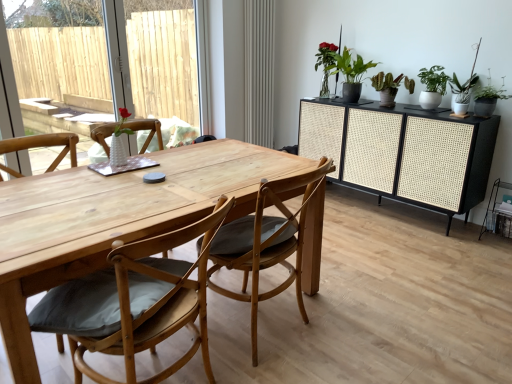
Measure the distance between point (103, 223) and camera.

Point (103, 223) and camera are 4.85 feet apart.

What do you see at coordinates (432, 86) in the screenshot? I see `green matte plant at upper right, the first houseplant viewed from the right` at bounding box center [432, 86].

Find the location of a particular element. green matte plant at upper right, which is the third houseplant from left to right is located at coordinates (432, 86).

This screenshot has height=384, width=512. What do you see at coordinates (390, 87) in the screenshot?
I see `green matte cactus at upper right, which is the 2th houseplant from left to right` at bounding box center [390, 87].

I want to click on green matte plant at upper right, the third houseplant from the right, so click(x=350, y=73).

Locate an element on the screen. This screenshot has width=512, height=384. white textured vase at left is located at coordinates (164, 67).

What do you see at coordinates (325, 64) in the screenshot? The image size is (512, 384). I see `green glossy vase at upper center` at bounding box center [325, 64].

Locate an element on the screen. The image size is (512, 384). matte gray radiator at center is located at coordinates (259, 71).

Which is more to the left, green matte plant at upper right, the third houseplant from the right, or green matte cactus at upper right, which is the 2th houseplant from left to right?

green matte plant at upper right, the third houseplant from the right.

In order to click on the 1st houseplant counting from the right of the green matte plant at upper right, the first houseplant from the left in this screenshot , I will do `click(390, 87)`.

Based on the photo, how distant is green matte plant at upper right, the third houseplant from the right, from green matte cactus at upper right, which is the 2th houseplant from left to right?

green matte plant at upper right, the third houseplant from the right, and green matte cactus at upper right, which is the 2th houseplant from left to right, are 24.72 centimeters apart.

Between green matte plant at upper right, the first houseplant from the left, and green matte cactus at upper right, the second houseplant in the right-to-left sequence, which one has larger width?

green matte cactus at upper right, the second houseplant in the right-to-left sequence, is wider.

Is white textured vase at left positioned far away from green matte cactus at upper right, the second houseplant in the right-to-left sequence?

Indeed, white textured vase at left is not near green matte cactus at upper right, the second houseplant in the right-to-left sequence.

In the image, is white textured vase at left positioned in front of or behind green matte cactus at upper right, the second houseplant in the right-to-left sequence?

In the image, white textured vase at left appears in front of green matte cactus at upper right, the second houseplant in the right-to-left sequence.

Can you confirm if white textured vase at left is smaller than green matte cactus at upper right, the second houseplant in the right-to-left sequence?

Actually, white textured vase at left might be larger than green matte cactus at upper right, the second houseplant in the right-to-left sequence.

Is the depth of green matte cactus at upper right, which is the 2th houseplant from left to right, greater than that of white textured vase at left?

Yes, green matte cactus at upper right, which is the 2th houseplant from left to right, is further from the camera.

Is there a large distance between green matte cactus at upper right, which is the 2th houseplant from left to right, and white textured vase at left?

That's right, there is a large distance between green matte cactus at upper right, which is the 2th houseplant from left to right, and white textured vase at left.

From a real-world perspective, between green matte cactus at upper right, which is the 2th houseplant from left to right, and white textured vase at left, who is vertically lower?

green matte cactus at upper right, which is the 2th houseplant from left to right.

Who is smaller, green matte cactus at upper right, the second houseplant in the right-to-left sequence, or white textured vase at left?

green matte cactus at upper right, the second houseplant in the right-to-left sequence, is smaller.

Identify the location of table on the left of green glossy vase at upper center. The image size is (512, 384). (112, 220).

Is green glossy vase at upper center looking in the opposite direction of natural wood table at center?

No, green glossy vase at upper center is not facing away from natural wood table at center.

Is green glossy vase at upper center positioned in front of natural wood table at center?

No, it is not.

Can you confirm if wooden chair with cushion at center, which is counted as the 2th chair, starting from the right, is wider than natural wood chair at center, arranged as the second chair when viewed from the left?

Indeed, wooden chair with cushion at center, which is counted as the 2th chair, starting from the right, has a greater width compared to natural wood chair at center, arranged as the second chair when viewed from the left.

Is wooden chair with cushion at center, which is counted as the 2th chair, starting from the right, positioned with its back to natural wood chair at center, which is counted as the 1th chair, starting from the right?

No, wooden chair with cushion at center, which is counted as the 2th chair, starting from the right,'s orientation is not away from natural wood chair at center, which is counted as the 1th chair, starting from the right.

From a real-world perspective, is wooden chair with cushion at center, which is counted as the 2th chair, starting from the right, over natural wood chair at center, which is counted as the 1th chair, starting from the right?

No.

Is wooden chair with cushion at center, which is counted as the 2th chair, starting from the right, shorter than natural wood chair at center, arranged as the second chair when viewed from the left?

Indeed, wooden chair with cushion at center, which is counted as the 2th chair, starting from the right, has a lesser height compared to natural wood chair at center, arranged as the second chair when viewed from the left.

Is matte gray radiator at center to the right of green glossy vase at upper center from the viewer's perspective?

No, matte gray radiator at center is not to the right of green glossy vase at upper center.

From the image's perspective, which is above, matte gray radiator at center or green glossy vase at upper center?

matte gray radiator at center.

In the scene shown: From a real-world perspective, who is located lower, matte gray radiator at center or green glossy vase at upper center?

From a 3D spatial view, matte gray radiator at center is below.

Does matte gray radiator at center have a greater width compared to green glossy vase at upper center?

No, matte gray radiator at center is not wider than green glossy vase at upper center.

Could you tell me if green matte plant at upper right, the first houseplant from the left, is turned towards black woven cabinet at right?

No, green matte plant at upper right, the first houseplant from the left, is not turned towards black woven cabinet at right.

How far apart are green matte plant at upper right, the third houseplant from the right, and black woven cabinet at right?

green matte plant at upper right, the third houseplant from the right, and black woven cabinet at right are 24.81 inches apart.

I want to click on houseplant that is the 2nd one when counting leftward from the black woven cabinet at right, so click(x=350, y=73).

Which object is wider, green matte plant at upper right, the first houseplant from the left, or black woven cabinet at right?

Wider between the two is black woven cabinet at right.

Where is `houseplant behind the green matte cactus at upper right, the second houseplant in the right-to-left sequence`? The height and width of the screenshot is (384, 512). houseplant behind the green matte cactus at upper right, the second houseplant in the right-to-left sequence is located at coordinates (350, 73).

You are a GUI agent. You are given a task and a screenshot of the screen. Output one action in this format:
    pyautogui.click(x=<x>, y=<y>)
    Task: Click on the houseplant that is the 2nd object directly below the white textured vase at left (from a real-world perspective)
    The image size is (512, 384).
    Given the screenshot: What is the action you would take?
    pyautogui.click(x=390, y=87)

Based on their spatial positions, is natural wood chair at center, arranged as the second chair when viewed from the left, or green glossy vase at upper center further from green matte plant at upper right, which is the third houseplant from left to right?

natural wood chair at center, arranged as the second chair when viewed from the left, lies further to green matte plant at upper right, which is the third houseplant from left to right, than the other object.

Estimate the real-world distances between objects in this image. Which object is further from green glossy vase at upper center, white textured vase at left or natural wood table at center?

The object further to green glossy vase at upper center is white textured vase at left.

When comparing their distances from black woven cabinet at right, does natural wood table at center or green matte plant at upper right, the first houseplant viewed from the right, seem closer?

green matte plant at upper right, the first houseplant viewed from the right.

When comparing their distances from green glossy vase at upper center, does wooden chair with cushion at center, positioned as the 1th chair in left-to-right order, or white textured vase at left seem closer?

wooden chair with cushion at center, positioned as the 1th chair in left-to-right order, is closer to green glossy vase at upper center.

When comparing their distances from natural wood chair at center, arranged as the second chair when viewed from the left, does green glossy vase at upper center or matte gray radiator at center seem further?

matte gray radiator at center is further to natural wood chair at center, arranged as the second chair when viewed from the left.

Estimate the real-world distances between objects in this image. Which object is closer to white textured vase at left, green matte plant at upper right, the first houseplant viewed from the right, or matte gray radiator at center?

Based on the image, matte gray radiator at center appears to be nearer to white textured vase at left.

Consider the image. Which object lies nearer to the anchor point green glossy vase at upper center, green matte plant at upper right, the third houseplant from the right, or green matte cactus at upper right, the second houseplant in the right-to-left sequence?

green matte plant at upper right, the third houseplant from the right, is closer to green glossy vase at upper center.

In the scene shown: Estimate the real-world distances between objects in this image. Which object is closer to green matte plant at upper right, the first houseplant from the left, natural wood chair at center, which is counted as the 1th chair, starting from the right, or natural wood table at center?

natural wood chair at center, which is counted as the 1th chair, starting from the right.

Locate an element on the screen. window screen between natural wood table at center and matte gray radiator at center from front to back is located at coordinates (164, 67).

At what (x,y) coordinates should I click in order to perform the action: click on houseplant between green glossy vase at upper center and green matte cactus at upper right, the second houseplant in the right-to-left sequence, in the horizontal direction. Please return your answer as a coordinate pair (x, y). Looking at the image, I should click on (350, 73).

Where is `plant situated between white textured vase at left and green matte plant at upper right, the first houseplant from the left, from left to right`? The width and height of the screenshot is (512, 384). plant situated between white textured vase at left and green matte plant at upper right, the first houseplant from the left, from left to right is located at coordinates (325, 64).

Locate an element on the screen. window screen between natural wood chair at center, which is counted as the 1th chair, starting from the right, and matte gray radiator at center in the front-back direction is located at coordinates click(x=164, y=67).